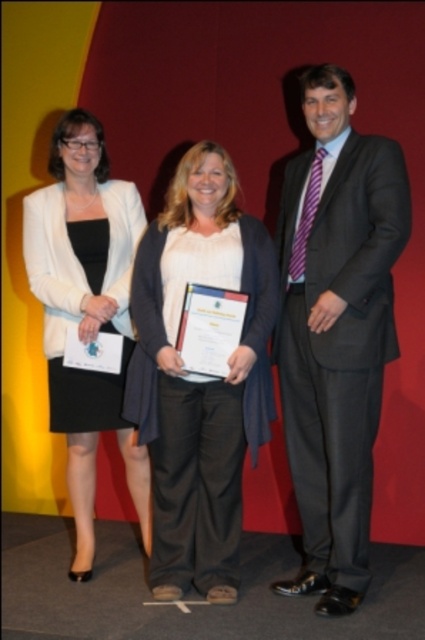
Question: Which is farther from the matte white sweater at center?

Choices:
 (A) matte white blazer at left
 (B) dark gray suit at center

Answer: (A)

Question: Among these points, which one is nearest to the camera?

Choices:
 (A) (81, 468)
 (B) (235, 490)

Answer: (B)

Question: Does dark gray suit at center come in front of matte white sweater at center?

Choices:
 (A) yes
 (B) no

Answer: (A)

Question: Which point is farther to the camera?

Choices:
 (A) matte white blazer at left
 (B) dark gray suit at center

Answer: (A)

Question: Does matte white sweater at center appear on the right side of matte white blazer at left?

Choices:
 (A) no
 (B) yes

Answer: (B)

Question: Does dark gray suit at center have a larger size compared to matte white sweater at center?

Choices:
 (A) yes
 (B) no

Answer: (A)